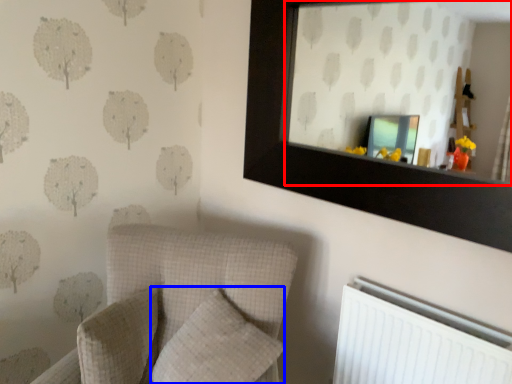
Question: Among these objects, which one is nearest to the camera, mirror (highlighted by a red box) or pillow (highlighted by a blue box)?

Choices:
 (A) mirror
 (B) pillow

Answer: (A)